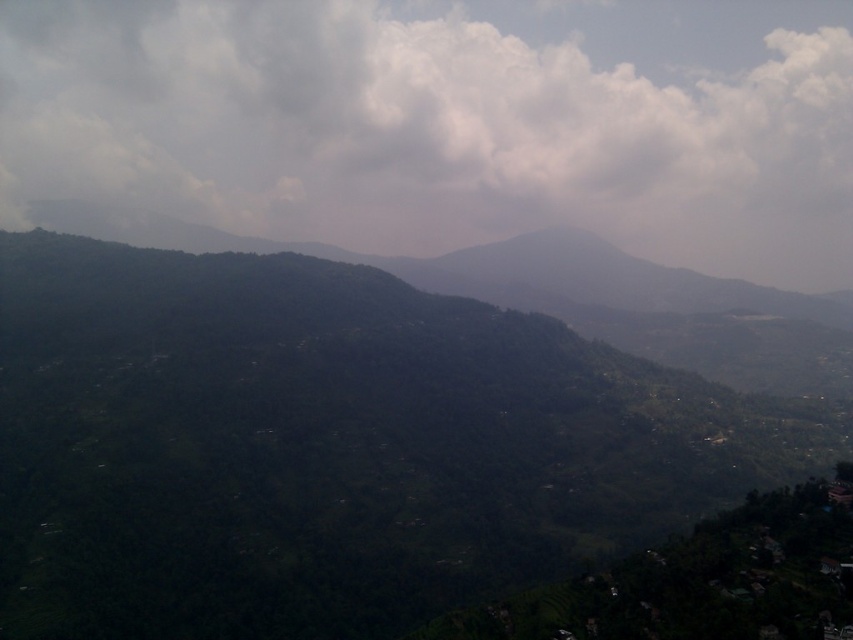
Is point (561, 524) positioned behind point (695, 42)?

No.

Who is higher up, green leafy mountain at center or white fluffy cloud at upper center?

white fluffy cloud at upper center

The width and height of the screenshot is (853, 640). I want to click on green leafy mountain at center, so tap(329, 445).